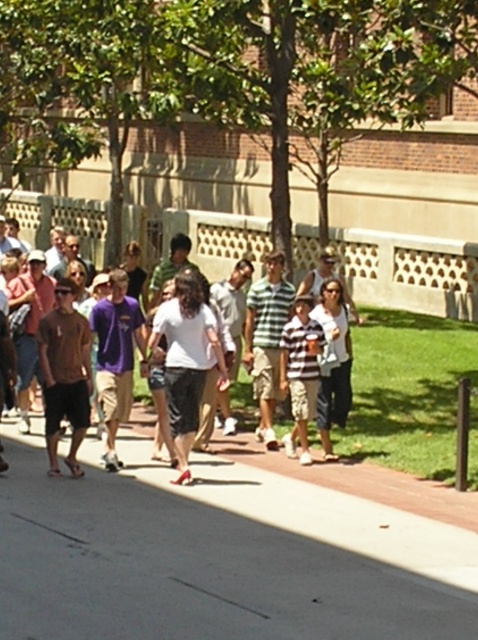
Does gray concrete sidewalk at center come behind striped fabric shirt at center?

No.

Does point (427, 573) come closer to viewer compared to point (301, 413)?

Yes, point (427, 573) is in front of point (301, 413).

Does point (19, 548) come behind point (318, 330)?

No, (19, 548) is closer to viewer.

Where is `gray concrete sidewalk at center`? gray concrete sidewalk at center is located at coordinates (217, 557).

Can you confirm if white cotton shirt at center is bigger than striped fabric shirt at center?

Correct, white cotton shirt at center is larger in size than striped fabric shirt at center.

Does white cotton shirt at center appear on the right side of striped fabric shirt at center?

No, white cotton shirt at center is not to the right of striped fabric shirt at center.

Which is behind, point (304, 252) or point (302, 420)?

The point (304, 252) is behind.

Locate an element on the screen. The width and height of the screenshot is (478, 640). white cotton shirt at center is located at coordinates (219, 240).

Can you confirm if gray concrete sidewalk at center is wider than white cotton shirt at center?

No, gray concrete sidewalk at center is not wider than white cotton shirt at center.

Image resolution: width=478 pixels, height=640 pixels. I want to click on gray concrete sidewalk at center, so 217,557.

Does point (110, 502) come behind point (256, 252)?

No, it is not.

At what (x,y) coordinates should I click in order to perform the action: click on gray concrete sidewalk at center. Please return your answer as a coordinate pair (x, y). This screenshot has height=640, width=478. Looking at the image, I should click on pos(217,557).